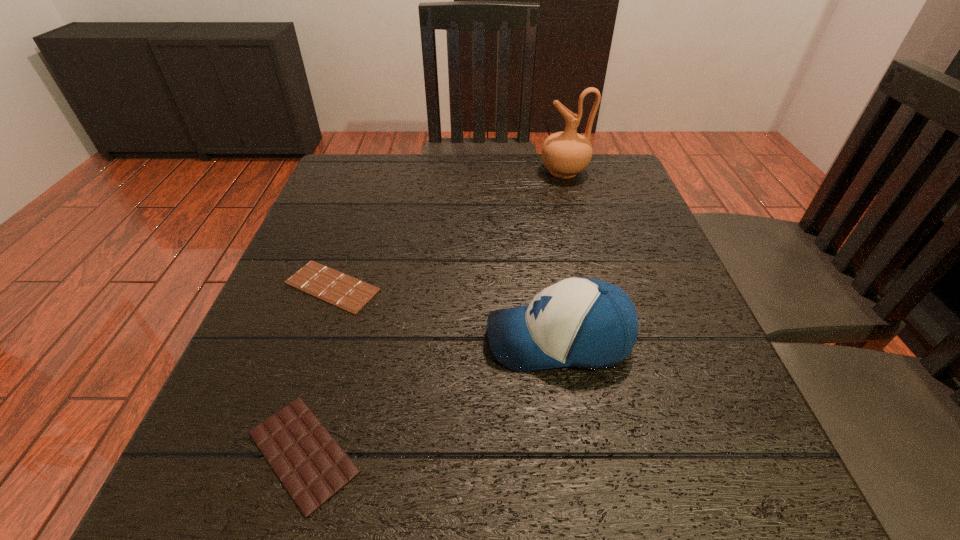
The width and height of the screenshot is (960, 540). Identify the location of empty space between the farther chocolate bar and the pottery. (448, 229).

You are a GUI agent. You are given a task and a screenshot of the screen. Output one action in this format:
    pyautogui.click(x=<x>, y=<y>)
    Task: Click on the empty space between the farthest object and the farther chocolate bar
    The width and height of the screenshot is (960, 540).
    Given the screenshot: What is the action you would take?
    pyautogui.click(x=448, y=229)

This screenshot has width=960, height=540. I want to click on free spot between the tallest object and the nearer chocolate bar, so click(x=434, y=312).

At what (x,y) coordinates should I click in order to perform the action: click on vacant area that lies between the pottery and the farther chocolate bar. Please return your answer as a coordinate pair (x, y). This screenshot has width=960, height=540. Looking at the image, I should click on (448, 229).

I want to click on empty space that is in between the farthest object and the baseball cap, so click(562, 255).

Locate which object is the closest to the farther chocolate bar. Please provide its 2D coordinates. Your answer should be formatted as a tuple, i.e. [(x, y)], where the tuple contains the x and y coordinates of a point satisfying the conditions above.

[(312, 466)]

The image size is (960, 540). What are the coordinates of `object that is the closest to the nearer chocolate bar` in the screenshot? It's located at (341, 290).

Find the location of a particular element. The height and width of the screenshot is (540, 960). vacant region that satisfies the following two spatial constraints: 1. on the spout of the farthest object; 2. on the front side of the farther chocolate bar is located at coordinates (595, 286).

Where is `vacant area in the image that satisfies the following two spatial constraints: 1. on the spout of the tallest object; 2. on the front side of the nearer chocolate bar`? The image size is (960, 540). vacant area in the image that satisfies the following two spatial constraints: 1. on the spout of the tallest object; 2. on the front side of the nearer chocolate bar is located at coordinates (641, 452).

Find the location of a particular element. The height and width of the screenshot is (540, 960). vacant space that satisfies the following two spatial constraints: 1. on the front-facing side of the baseball cap; 2. on the front side of the nearer chocolate bar is located at coordinates (577, 452).